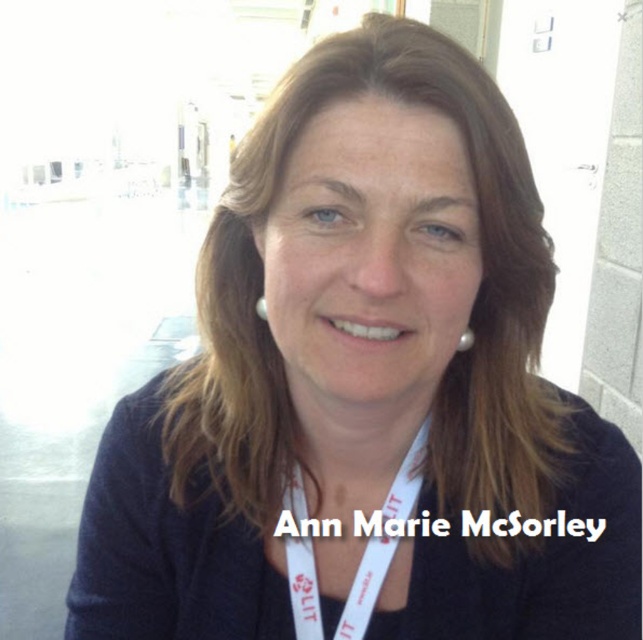
Does point (307, 586) come in front of point (260, 300)?

Yes, point (307, 586) is closer to viewer.

Which is more to the right, white fabric lanyard at center or pearl earring at upper center?

white fabric lanyard at center is more to the right.

Is point (404, 484) closer to camera compared to point (266, 317)?

No, it is behind (266, 317).

Identify the location of white fabric lanyard at center. The image size is (643, 640). (383, 541).

Can you confirm if skinsmoothneck at center is wider than white fabric lanyard at center?

Yes, skinsmoothneck at center is wider than white fabric lanyard at center.

Based on the photo, does skinsmoothneck at center appear on the left side of white fabric lanyard at center?

In fact, skinsmoothneck at center is to the right of white fabric lanyard at center.

Between point (376, 348) and point (392, 522), which one is positioned behind?

The point (392, 522) is more distant.

Locate an element on the screen. The width and height of the screenshot is (643, 640). skinsmoothneck at center is located at coordinates (358, 412).

Can you confirm if pearlelegantearring at upper center is taller than pearl earring at upper center?

Incorrect, pearlelegantearring at upper center's height is not larger of pearl earring at upper center's.

This screenshot has height=640, width=643. I want to click on pearlelegantearring at upper center, so click(x=466, y=340).